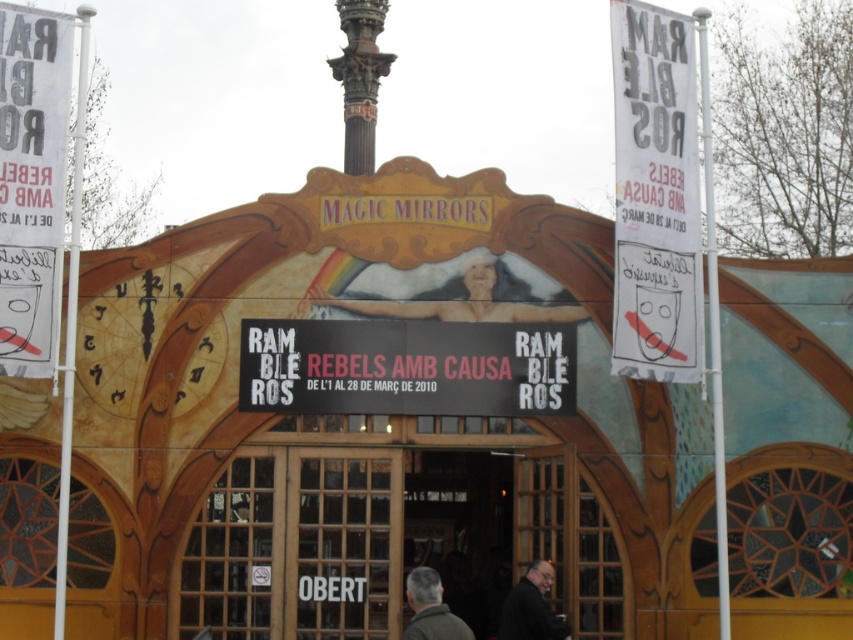
Question: Among these objects, which one is nearest to the camera?

Choices:
 (A) black matte sign at center
 (B) white paper banner at upper right

Answer: (B)

Question: Can you confirm if wooden door at center is wider than dark gray suit at lower center?

Choices:
 (A) yes
 (B) no

Answer: (A)

Question: Is wooden door at center wider than black matte sign at center?

Choices:
 (A) no
 (B) yes

Answer: (B)

Question: Is black matte sign at center positioned at the back of smooth skin figure at center?

Choices:
 (A) yes
 (B) no

Answer: (B)

Question: Which is farther from the black matte sign at center?

Choices:
 (A) dark gray suit at lower center
 (B) white paper banner at left
 (C) white paper banner at upper right
 (D) wooden door at center

Answer: (B)

Question: Considering the real-world distances, which object is closest to the gray woolen jacket at lower center?

Choices:
 (A) white paper banner at upper right
 (B) wooden door at center
 (C) dark gray suit at lower center
 (D) smooth skin figure at center

Answer: (B)